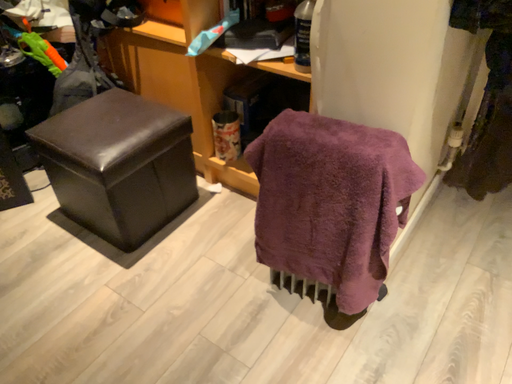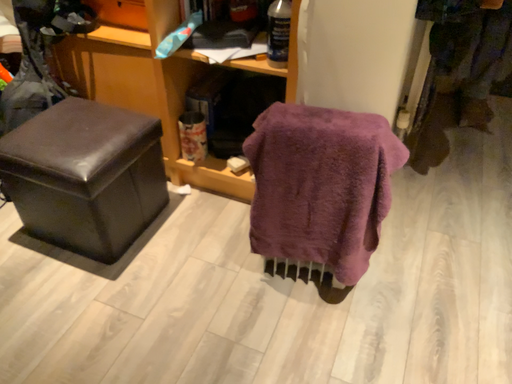
Question: How did the camera likely rotate when shooting the video?

Choices:
 (A) rotated right
 (B) rotated left

Answer: (A)